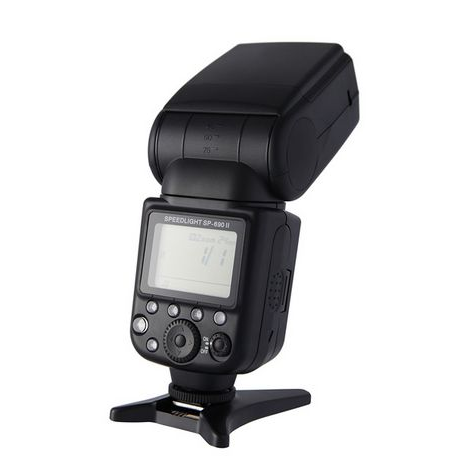
Identify the location of screen. The image size is (460, 460). (201, 272).